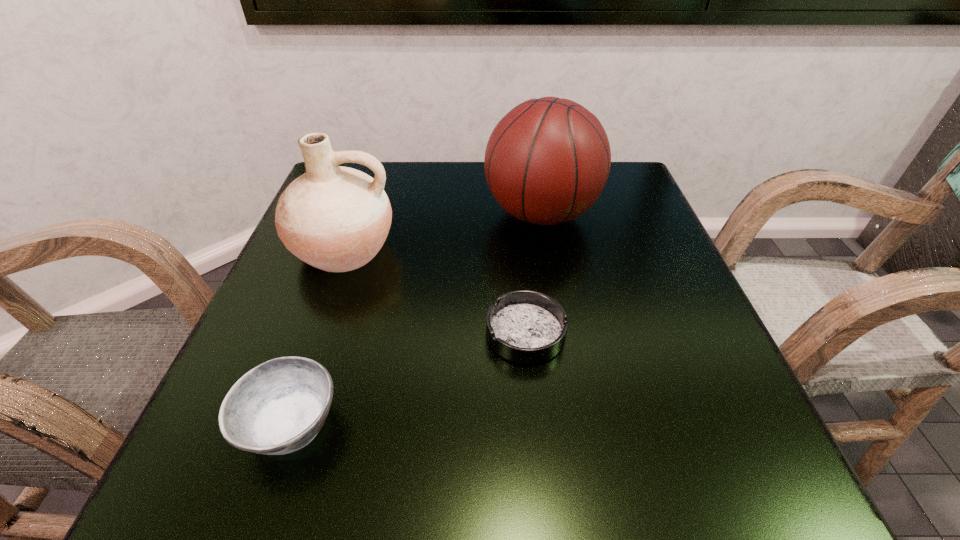
Identify the location of free space between the left ashtray and the basketball. (416, 319).

Where is `the second closest object to the pottery`? The height and width of the screenshot is (540, 960). the second closest object to the pottery is located at coordinates (523, 326).

This screenshot has height=540, width=960. What are the coordinates of `the closest object to the third farthest object` in the screenshot? It's located at pyautogui.click(x=547, y=160).

Find the location of a particular element. Image resolution: width=960 pixels, height=540 pixels. vacant space that satisfies the following two spatial constraints: 1. to pour from the handle of the pottery; 2. on the left side of the second shortest object is located at coordinates (282, 424).

Where is `free location that satisfies the following two spatial constraints: 1. to pour from the handle of the taller ashtray; 2. on the right side of the pottery`? This screenshot has width=960, height=540. free location that satisfies the following two spatial constraints: 1. to pour from the handle of the taller ashtray; 2. on the right side of the pottery is located at coordinates (282, 424).

Identify the location of free spot that satisfies the following two spatial constraints: 1. to pour from the handle of the nearest object; 2. on the right side of the pottery. (282, 424).

Find the location of a particular element. vacant point that satisfies the following two spatial constraints: 1. to pour from the handle of the right ashtray; 2. on the left side of the pottery is located at coordinates (314, 333).

Where is `free space that satisfies the following two spatial constraints: 1. on the back side of the shorter ashtray; 2. on the right side of the second shortest object`? Image resolution: width=960 pixels, height=540 pixels. free space that satisfies the following two spatial constraints: 1. on the back side of the shorter ashtray; 2. on the right side of the second shortest object is located at coordinates 322,333.